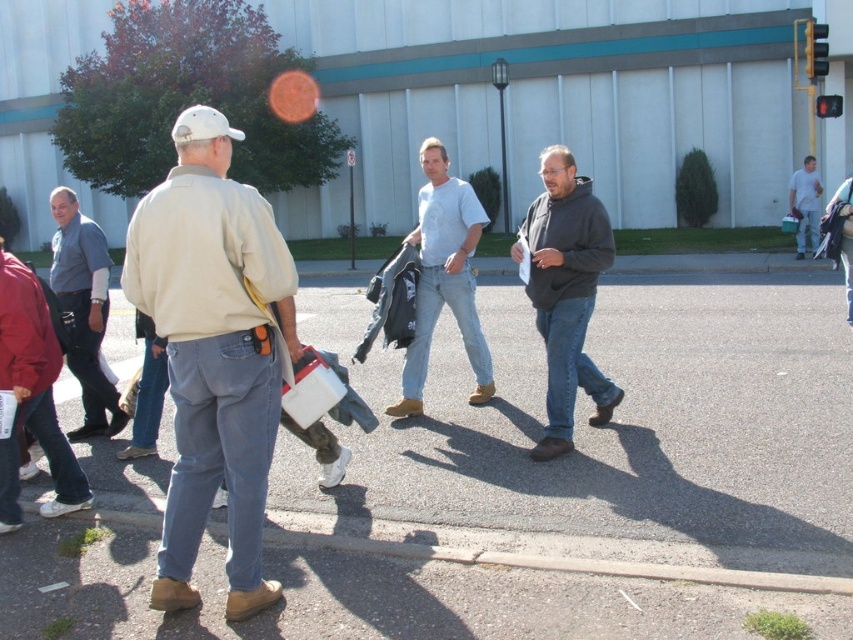
You are a pedestrian trying to cross the street and see the dark gray hoodie at center and the blue denim jeans at left. Which one is closer to you?

The dark gray hoodie at center is closer to you because it is positioned under the blue denim jeans at left, indicating it is in front.

You are a pedestrian trying to cross the street and need to avoid the beige fabric jacket at left. What is the best direction to move to stay clear of it?

The beige fabric jacket at left is located at point (213, 352), so moving away from that coordinate would keep you clear of it.

You are a pedestrian trying to cross the street and see the beige fabric jacket at left and the light blue shirt at center. Which person is closer to you?

The beige fabric jacket at left is closer to you because it is in front of the light blue shirt at center.